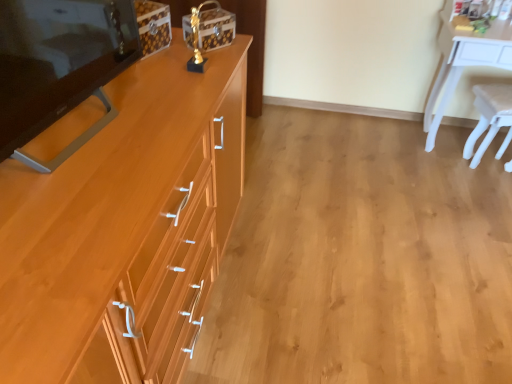
Where is `free space between white plastic chair at right and white glossy desk at upper right`? Image resolution: width=512 pixels, height=384 pixels. free space between white plastic chair at right and white glossy desk at upper right is located at coordinates (447, 168).